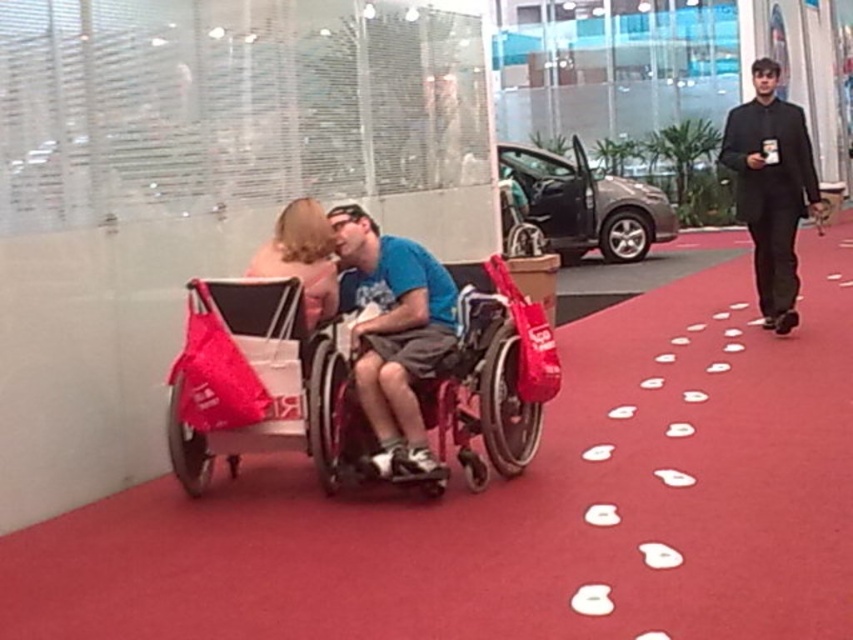
You are a photographer setting up a shoot in the showroom. You need to place a small decorative item between the matte red baby carriage at left and the blonde hair at center. Considering their sizes, which object should the item be placed closer to?

The matte red baby carriage at left is bigger than the blonde hair at center, so the small decorative item should be placed closer to the blonde hair at center to balance the composition.

You are a customer in the showroom and want to move from the entrance to the car in the background. There are two objects in your path, the matte red baby carriage at left and the black suit at right. Which object should you avoid to reach the car without obstruction?

The matte red baby carriage at left is positioned on the left side of the black suit at right, so to reach the car without obstruction, you should avoid the matte red baby carriage at left by moving around it to the right side of the black suit at right.

You are standing in the showroom and want to place a small decoration between the two points, point (x=242, y=376) and point (x=788, y=188). Which point should you move closer to ensure the decoration is near the viewer?

You should place the decoration closer to point (x=242, y=376) because it is closer to the viewer than point (x=788, y=188).